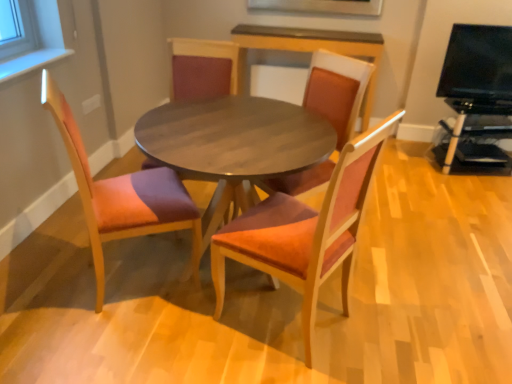
The height and width of the screenshot is (384, 512). I want to click on vacant space that's between black plastic entertainment center at right, which appears as the second entertainment center when viewed from the top, and matte wood chair at center, the 2th chair in the right-to-left sequence, so click(x=417, y=216).